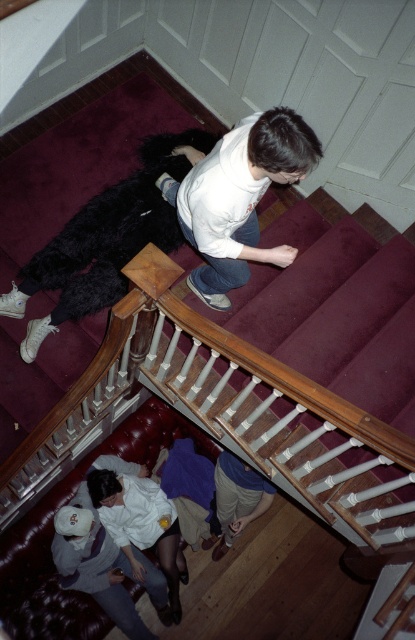
Question: Can you confirm if white cotton shirt at lower center is thinner than white fabric shirt at lower left?

Choices:
 (A) yes
 (B) no

Answer: (B)

Question: Estimate the real-world distances between objects in this image. Which object is farther from the white cotton shirt at lower center?

Choices:
 (A) white matte shirt at upper center
 (B) khaki cotton pants at lower center

Answer: (A)

Question: Observing the image, what is the correct spatial positioning of white matte shirt at upper center in reference to white cotton shirt at lower center?

Choices:
 (A) right
 (B) left

Answer: (A)

Question: Which object is farther from the camera taking this photo?

Choices:
 (A) white fabric shirt at lower left
 (B) white matte shirt at upper center
 (C) maroon carpet at upper center
 (D) khaki cotton pants at lower center

Answer: (D)

Question: Which of the following is the closest to the observer?

Choices:
 (A) (292, 109)
 (B) (241, 520)
 (C) (102, 483)

Answer: (A)

Question: Is maroon carpet at upper center positioned in front of white fabric shirt at lower left?

Choices:
 (A) no
 (B) yes

Answer: (B)